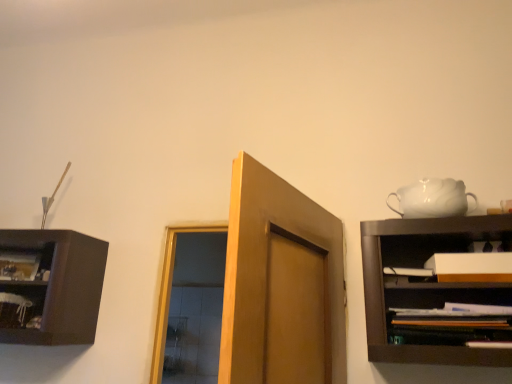
Question: Considering the relative sizes of wooden shelf at right, which is the 2th shelf from left to right, and white glossy teapot at upper right in the image provided, is wooden shelf at right, which is the 2th shelf from left to right, smaller than white glossy teapot at upper right?

Choices:
 (A) yes
 (B) no

Answer: (B)

Question: Does wooden shelf at right, which is the 1th shelf in right-to-left order, have a greater height compared to white glossy teapot at upper right?

Choices:
 (A) yes
 (B) no

Answer: (B)

Question: Is the surface of wooden shelf at right, the 1th shelf viewed from the front, in direct contact with white glossy teapot at upper right?

Choices:
 (A) no
 (B) yes

Answer: (A)

Question: Does wooden shelf at right, the 1th shelf viewed from the front, turn towards white glossy teapot at upper right?

Choices:
 (A) yes
 (B) no

Answer: (B)

Question: From a real-world perspective, is wooden shelf at right, the 1th shelf viewed from the front, under white glossy teapot at upper right?

Choices:
 (A) no
 (B) yes

Answer: (B)

Question: Is wooden shelf at right, the 1th shelf viewed from the front, oriented away from white glossy teapot at upper right?

Choices:
 (A) yes
 (B) no

Answer: (B)

Question: Does wooden shelf at left, which is the second shelf in front-to-back order, lie behind white matte cabinet at right?

Choices:
 (A) yes
 (B) no

Answer: (A)

Question: From the image's perspective, is wooden shelf at left, which is the second shelf in front-to-back order, over white matte cabinet at right?

Choices:
 (A) yes
 (B) no

Answer: (B)

Question: Is wooden shelf at left, acting as the 1th shelf starting from the back, turned away from white matte cabinet at right?

Choices:
 (A) no
 (B) yes

Answer: (A)

Question: Can you confirm if wooden shelf at left, which is the second shelf in front-to-back order, is taller than white matte cabinet at right?

Choices:
 (A) yes
 (B) no

Answer: (A)

Question: Is wooden shelf at left, which is the 2th shelf from right to left, bigger than white matte cabinet at right?

Choices:
 (A) yes
 (B) no

Answer: (A)

Question: Is wooden shelf at left, acting as the 1th shelf starting from the back, to the left of white matte cabinet at right from the viewer's perspective?

Choices:
 (A) yes
 (B) no

Answer: (A)

Question: Does white matte cabinet at right have a smaller size compared to wooden shelf at left, which is the second shelf in front-to-back order?

Choices:
 (A) no
 (B) yes

Answer: (B)